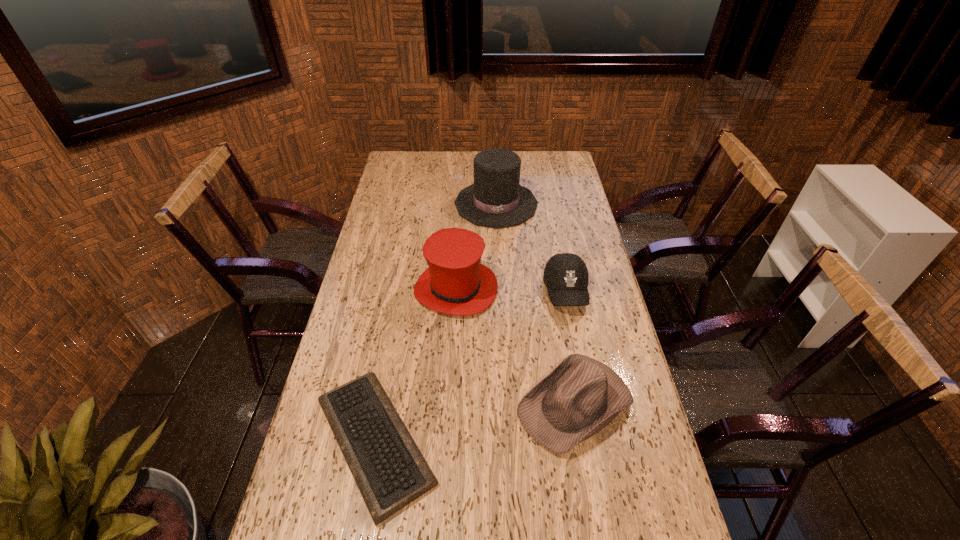
Where is `the farther hat`? Image resolution: width=960 pixels, height=540 pixels. the farther hat is located at coordinates (495, 199).

Identify the location of the nearer hat. (456, 283).

Locate an element on the screen. baseball cap is located at coordinates (566, 277).

Locate an element on the screen. This screenshot has height=540, width=960. fedora is located at coordinates (581, 396).

Identify the location of computer keyboard. Image resolution: width=960 pixels, height=540 pixels. (390, 472).

Locate an element on the screen. vacant position located on the front of the farthest object with the decoration is located at coordinates (499, 267).

Identify the location of free spot located 0.380m on the right of the nearer hat. The image size is (960, 540). (609, 289).

This screenshot has width=960, height=540. Find the location of `free region located on the front-facing side of the baseball cap`. free region located on the front-facing side of the baseball cap is located at coordinates click(586, 393).

In order to click on vacant space located on the back of the fedora in this screenshot , I will do `click(564, 335)`.

At what (x,y) coordinates should I click in order to perform the action: click on vacant space located on the back of the shortest object. Please return your answer as a coordinate pair (x, y). Image resolution: width=960 pixels, height=540 pixels. Looking at the image, I should click on (394, 337).